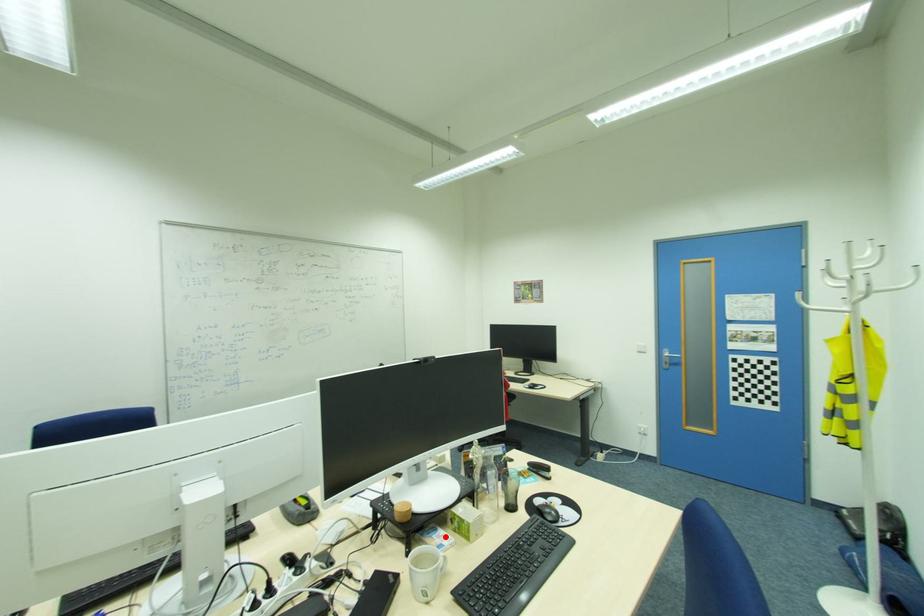
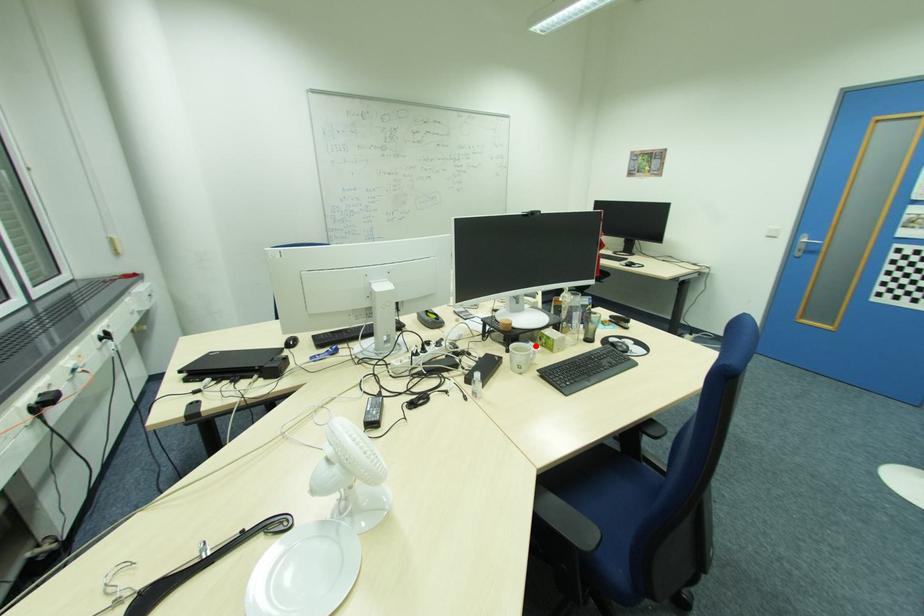
I am providing you with two images of the same scene from different viewpoints. A red point is marked on the first image and another point is marked on the second image. Is the red point in image1 aligned with the point shown in image2?

Yes